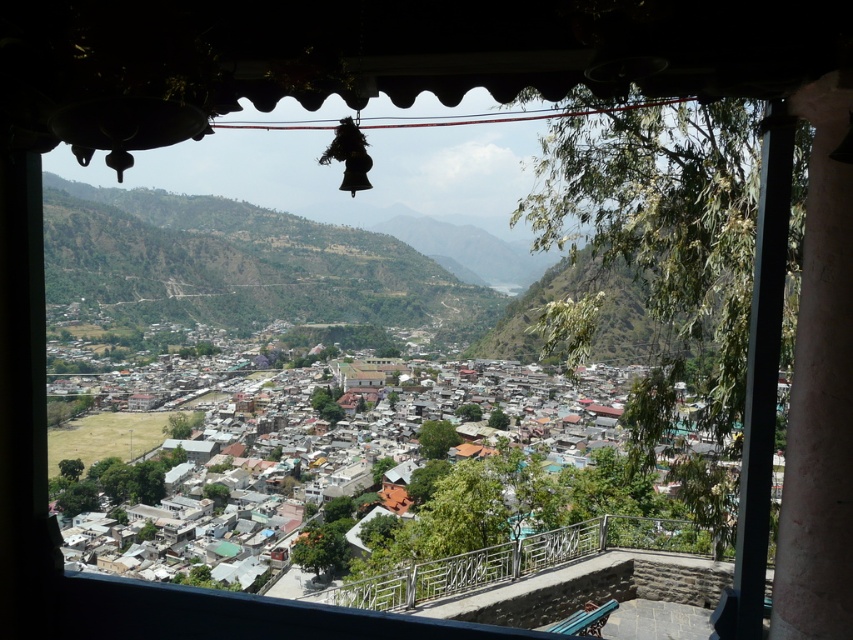
You are standing on the balcony and want to reach the point at coordinates (482, 500). If your walking speed is 1.5 meters per second, how many seconds will it take you to reach that point?

The point at coordinates (482, 500) is 144.00 meters away from you. At a walking speed of 1.5 meters per second, it will take 144 divided by 1.5 equals 96 seconds to reach that point.

You are standing on the balcony and want to take a photo of the rustic wooden houses at center. Which direction should you point your camera to capture them?

The rustic wooden houses at center are located at point 0.809 on the horizontal axis and 0.623 on the vertical axis, so you should point your camera towards the center of the view to capture them.

You are standing on a balcony and want to take a photo of the rustic wooden houses at center while avoiding the metallic railing at lower center from blocking the view. Which direction should you move to ensure the railing is out of frame?

You should move to the right because the rustic wooden houses at center are to the left of the metallic railing at lower center, so moving right would shift the railing out of the frame.